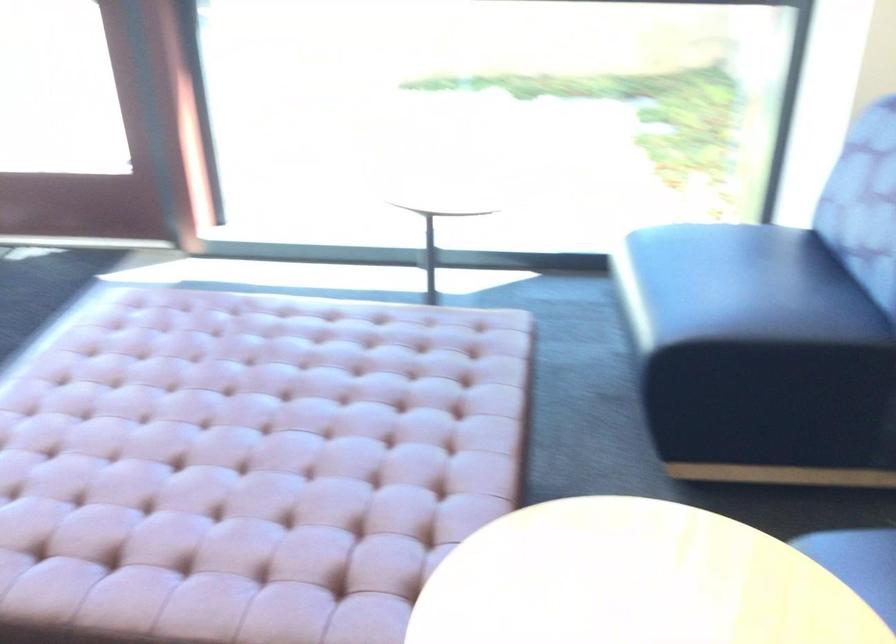
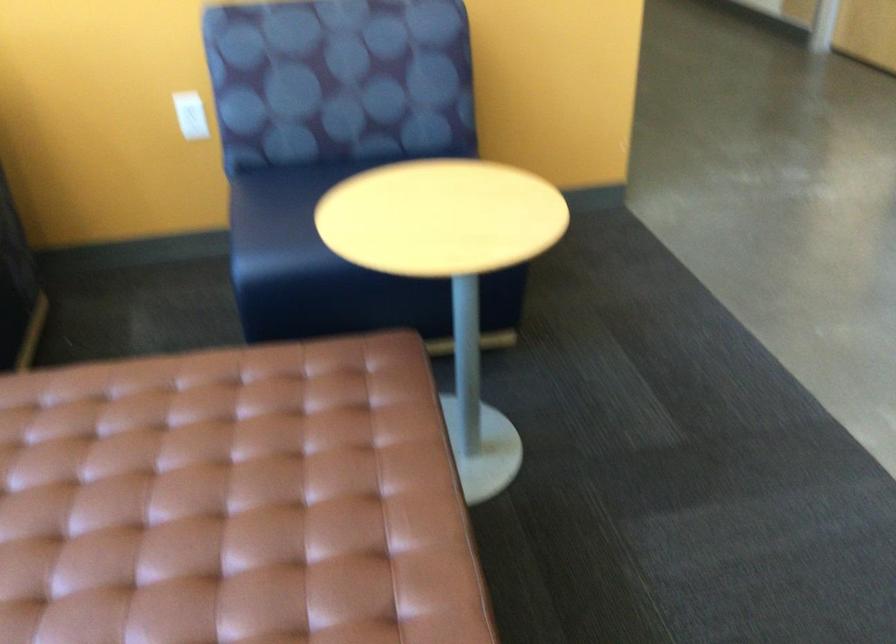
Question: I am providing you with two images of the same scene from different viewpoints. Which of the following objects are not visible in image2?

Choices:
 (A) white light switch
 (B) chair sitting surface
 (C) sofa sitting surface
 (D) none of these

Answer: (D)